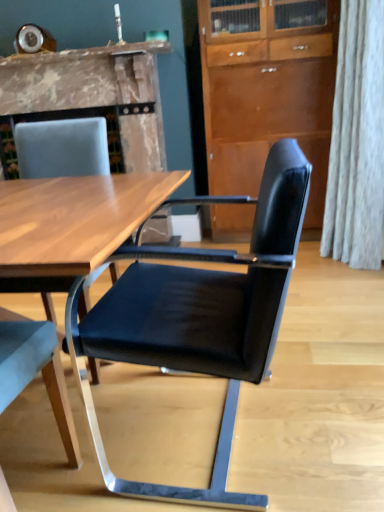
Question: From a real-world perspective, is black leather chair at center, the first chair viewed from the right, physically located above or below marble fireplace at upper left?

Choices:
 (A) below
 (B) above

Answer: (A)

Question: Considering the positions of black leather chair at center, the first chair viewed from the right, and marble fireplace at upper left in the image, is black leather chair at center, the first chair viewed from the right, taller or shorter than marble fireplace at upper left?

Choices:
 (A) tall
 (B) short

Answer: (A)

Question: Estimate the real-world distances between objects in this image. Which object is farther from the marble fireplace at upper left?

Choices:
 (A) black leather chair at right, acting as the 2th chair starting from the right
 (B) wooden cabinet at center
 (C) black leather chair at center, the first chair viewed from the right

Answer: (A)

Question: Estimate the real-world distances between objects in this image. Which object is farther from the black leather chair at right, the 1th chair viewed from the left?

Choices:
 (A) wooden cabinet at center
 (B) black leather chair at center, the first chair viewed from the right
 (C) marble fireplace at upper left

Answer: (A)